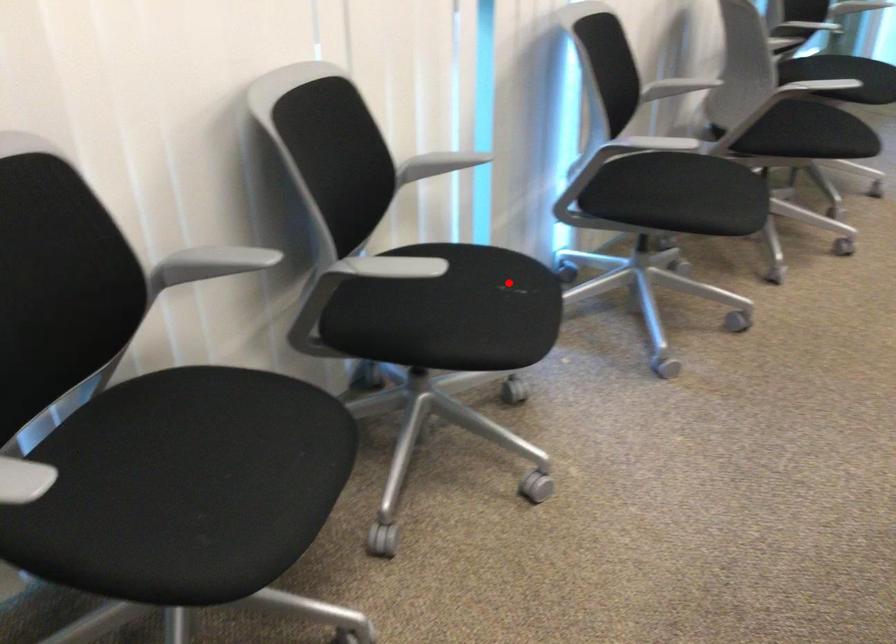
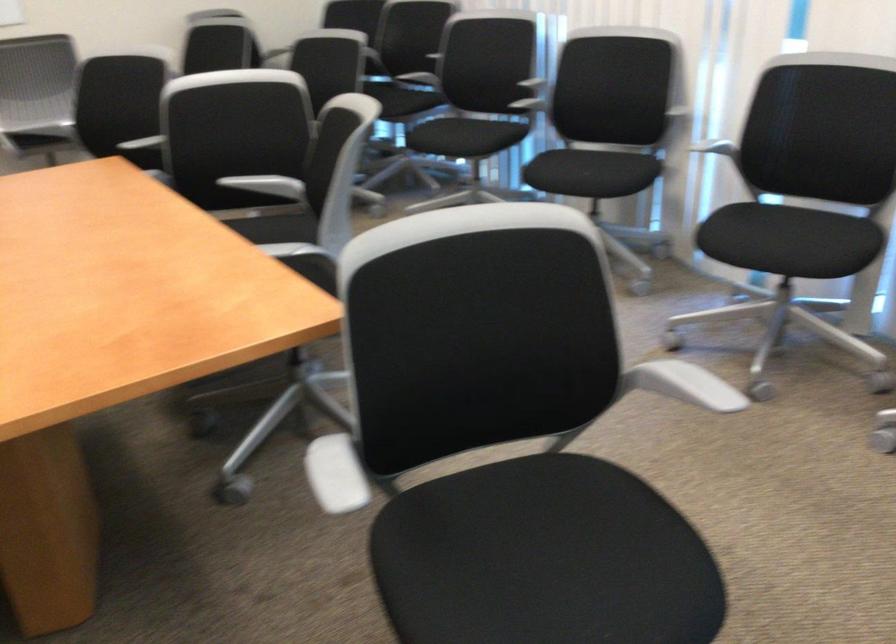
Question: I am providing you with two images of the same scene from different viewpoints. Image1 has a red point marked. In image2, the corresponding 3D location appears at what relative position? Reply with the corresponding letter.

Choices:
 (A) Closer
 (B) Farther

Answer: (B)